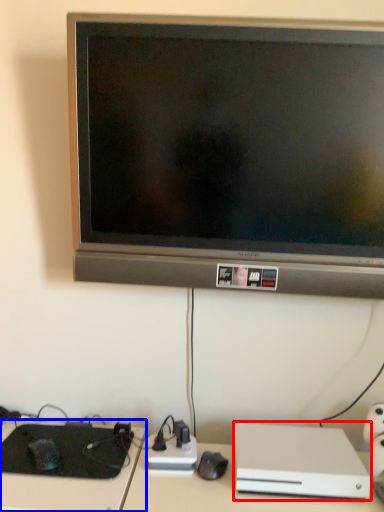
Question: Which object is closer to the camera taking this photo, computer (highlighted by a red box) or computer desk (highlighted by a blue box)?

Choices:
 (A) computer
 (B) computer desk

Answer: (A)